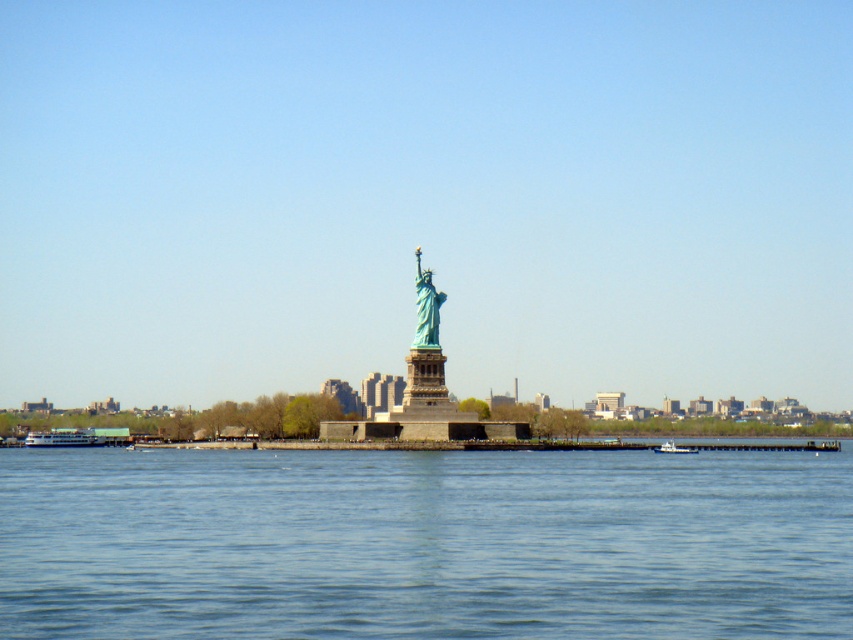
Is point (421, 324) positioned before point (686, 448)?

That is False.

Between point (438, 291) and point (693, 451), which one is positioned in front?

Point (693, 451) is in front.

Is point (433, 298) closer to camera compared to point (659, 449)?

That is False.

Locate an element on the screen. This screenshot has width=853, height=640. green patina statue at center is located at coordinates (426, 307).

Is point (245, 561) less distant than point (416, 266)?

Yes.

Between blue liquid water at center and green patina statue at center, which one has less height?

With less height is blue liquid water at center.

The height and width of the screenshot is (640, 853). What do you see at coordinates (424, 544) in the screenshot?
I see `blue liquid water at center` at bounding box center [424, 544].

The height and width of the screenshot is (640, 853). What are the coordinates of `blue liquid water at center` in the screenshot? It's located at (424, 544).

Between green patina statue at center and white glossy ferry at lower left, which one appears on the right side from the viewer's perspective?

green patina statue at center is more to the right.

What do you see at coordinates (426, 307) in the screenshot? The image size is (853, 640). I see `green patina statue at center` at bounding box center [426, 307].

Find the location of a particular element. The image size is (853, 640). green patina statue at center is located at coordinates (426, 307).